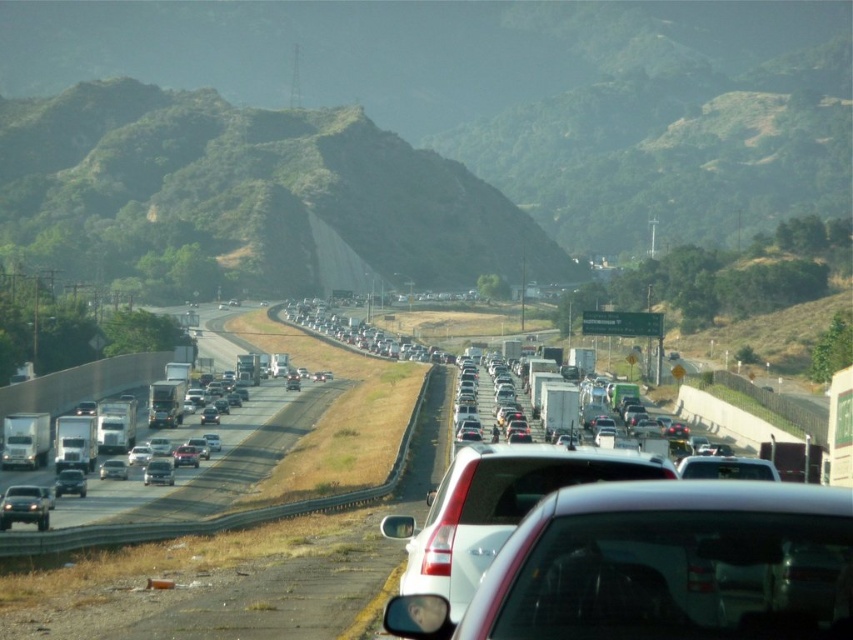
Question: Can you confirm if white glossy sedan at center is positioned to the left of silver metallic sedan at center?

Choices:
 (A) yes
 (B) no

Answer: (B)

Question: Which point is closer to the camera?

Choices:
 (A) (107, 460)
 (B) (9, 445)

Answer: (B)

Question: From the image, what is the correct spatial relationship of white glossy sedan at center in relation to metallic silver truck at left?

Choices:
 (A) above
 (B) below

Answer: (A)

Question: Does white glossy sedan at center have a greater width compared to silver metallic sedan at center?

Choices:
 (A) no
 (B) yes

Answer: (A)

Question: Which of the following is the closest to the observer?

Choices:
 (A) (112, 472)
 (B) (419, 550)
 (C) (47, 442)

Answer: (B)

Question: Which point is closer to the camera?

Choices:
 (A) (606, 461)
 (B) (39, 444)

Answer: (A)